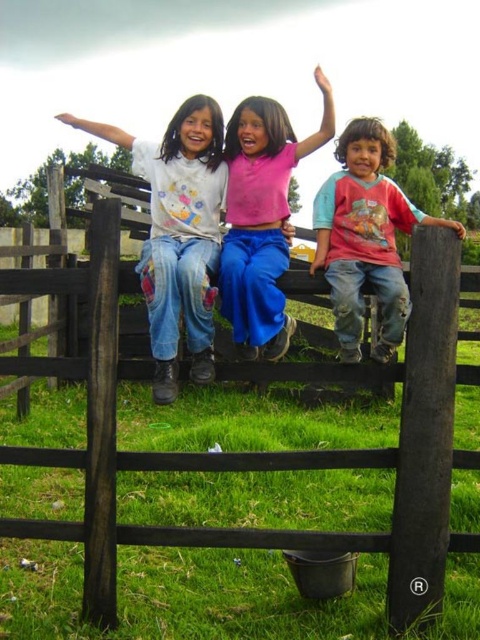
You are a tailor who needs to determine which pair of jeans requires more fabric to repair a tear. Based on the image, which of the two pairs, the denim jeans at left or the rough denim jeans at right, would need more fabric?

The rough denim jeans at right would need more fabric because they are thicker than the denim jeans at left.

You are a photographer trying to capture a group photo of the children on the wooden fence. You want to ensure that the pink matte shirt at center and the rough denim jeans at right are both clearly visible in the frame. Based on their positions, which object might require you to adjust your camera angle to avoid being obscured?

The pink matte shirt at center might be wider than the rough denim jeans at right, so adjusting the camera angle could help ensure both are visible without overlap.